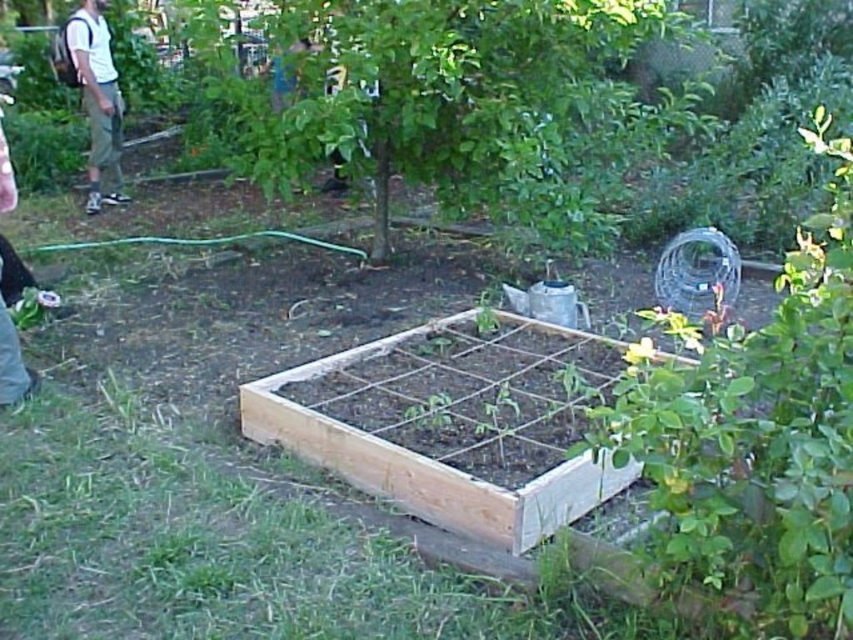
The width and height of the screenshot is (853, 640). What do you see at coordinates (450, 104) in the screenshot? I see `green leafy tree at center` at bounding box center [450, 104].

Between point (532, 160) and point (463, 400), which one is positioned behind?

Point (532, 160)

In order to click on green leafy tree at center in this screenshot , I will do `click(450, 104)`.

Which of these two, green leafy tree at center or white cotton shirt at upper left, stands taller?

With more height is white cotton shirt at upper left.

Who is more distant from viewer, (x=196, y=154) or (x=64, y=48)?

Positioned behind is point (x=196, y=154).

The width and height of the screenshot is (853, 640). Find the location of `green leafy tree at center`. green leafy tree at center is located at coordinates (450, 104).

Is natural wood flower bed at center positioned in front of white cotton shirt at upper left?

Yes.

The height and width of the screenshot is (640, 853). Describe the element at coordinates (450, 422) in the screenshot. I see `natural wood flower bed at center` at that location.

The height and width of the screenshot is (640, 853). I want to click on natural wood flower bed at center, so click(450, 422).